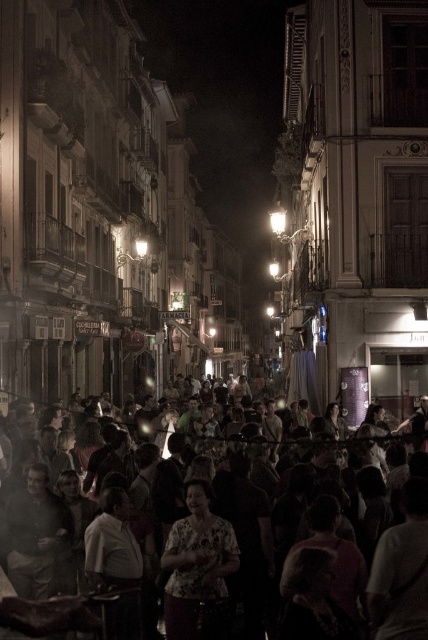
You are a photographer standing in the middle of the street trying to capture a closeup shot of the floral print blouse at center. Considering the multicolored fabric crowd at center is blocking your view, can you estimate whether the crowd is wider than the blouse?

The multicolored fabric crowd at center is wider than the floral print blouse at center, so the crowd is blocking the view of the blouse.

You are a photographer standing on the street and want to capture both the multicolored fabric crowd at center and the floral print blouse at center in a single photo. Which object should you focus on first to ensure both are in frame?

You should focus on the multicolored fabric crowd at center first because it is above the floral print blouse at center, so adjusting the camera angle to include the upper area will naturally include the lower one as well.